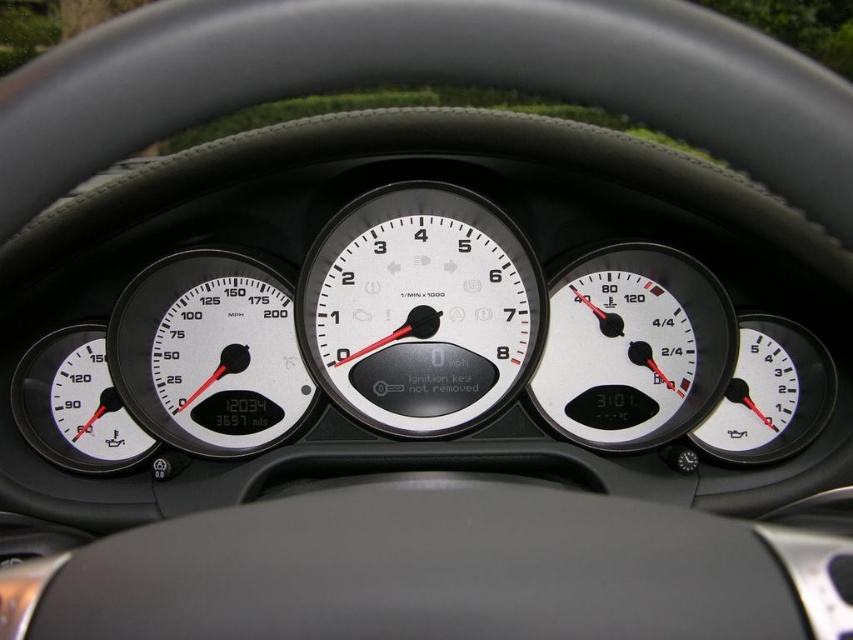
You are sitting in the driver seat of the vehicle and looking at the dashboard. There are two points marked on the instrument cluster. The first point is at coordinates point [462,253] and the second point is at point [274,442]. Which point appears closer to you when you look straight ahead?

Point [462,253] is further to the viewer than point [274,442], so the first point appears closer to you.